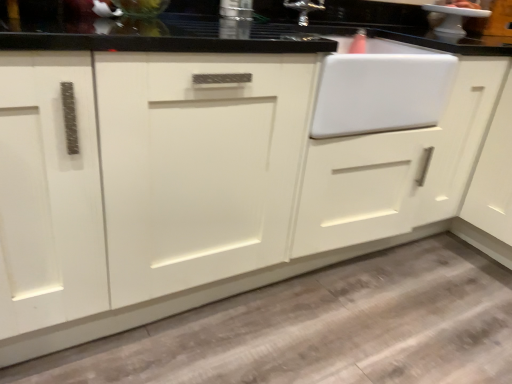
Image resolution: width=512 pixels, height=384 pixels. I want to click on white matte cabinet at right, so click(396, 169).

This screenshot has height=384, width=512. What do you see at coordinates (396, 169) in the screenshot?
I see `white matte cabinet at right` at bounding box center [396, 169].

Locate an element on the screen. white matte cabinet at right is located at coordinates (396, 169).